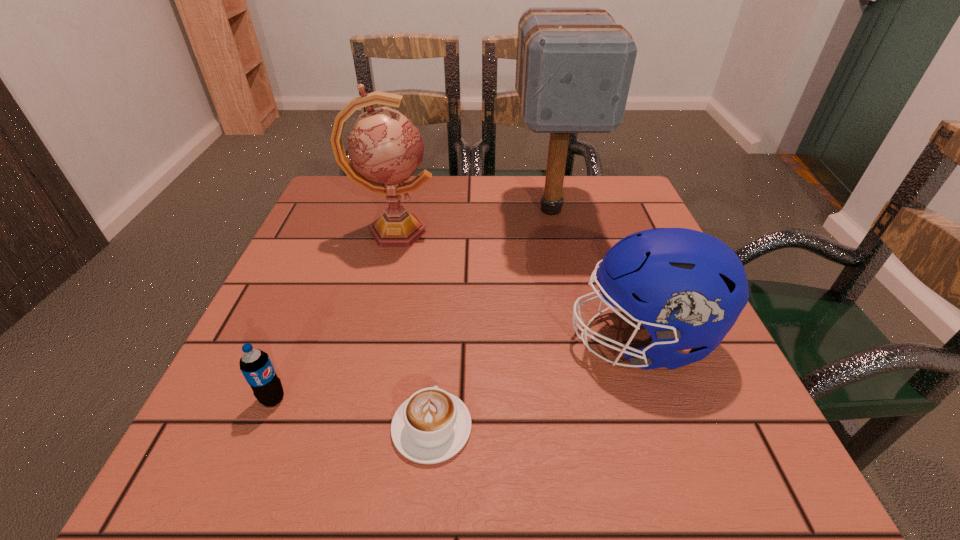
What are the coordinates of `mallet` in the screenshot? It's located at (574, 66).

Locate an element on the screen. Image resolution: width=960 pixels, height=540 pixels. the fourth shortest object is located at coordinates (385, 148).

Image resolution: width=960 pixels, height=540 pixels. I want to click on football helmet, so click(687, 288).

I want to click on the third shortest object, so click(687, 288).

At what (x,y) coordinates should I click in order to perform the action: click on the second shortest object. Please return your answer as a coordinate pair (x, y). Looking at the image, I should click on (256, 366).

I want to click on soda bottle, so click(256, 366).

You are a GUI agent. You are given a task and a screenshot of the screen. Output one action in this format:
    pyautogui.click(x=<x>, y=<y>)
    Task: Click on the cappuccino
    The width and height of the screenshot is (960, 540).
    Given the screenshot: What is the action you would take?
    pyautogui.click(x=431, y=426)

Identify the location of blank space located on the striking surface of the mallet. (578, 330).

Locate an element on the screen. vacant area located 0.280m on the front-facing side of the globe is located at coordinates point(558,232).

The width and height of the screenshot is (960, 540). I want to click on blank space located on the front-facing side of the third shortest object, so click(528, 339).